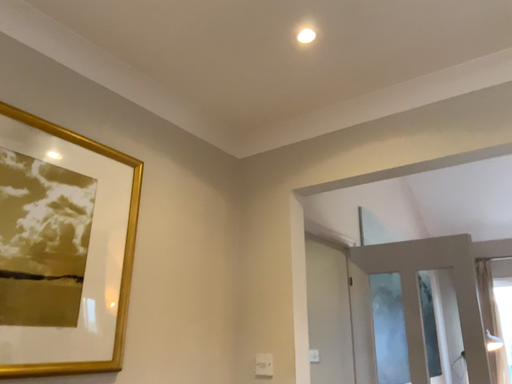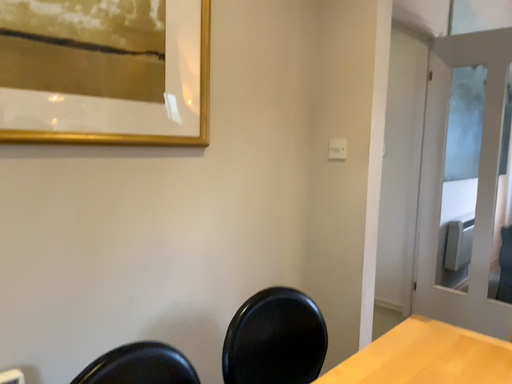
Question: How did the camera likely rotate when shooting the video?

Choices:
 (A) rotated right
 (B) rotated left

Answer: (B)